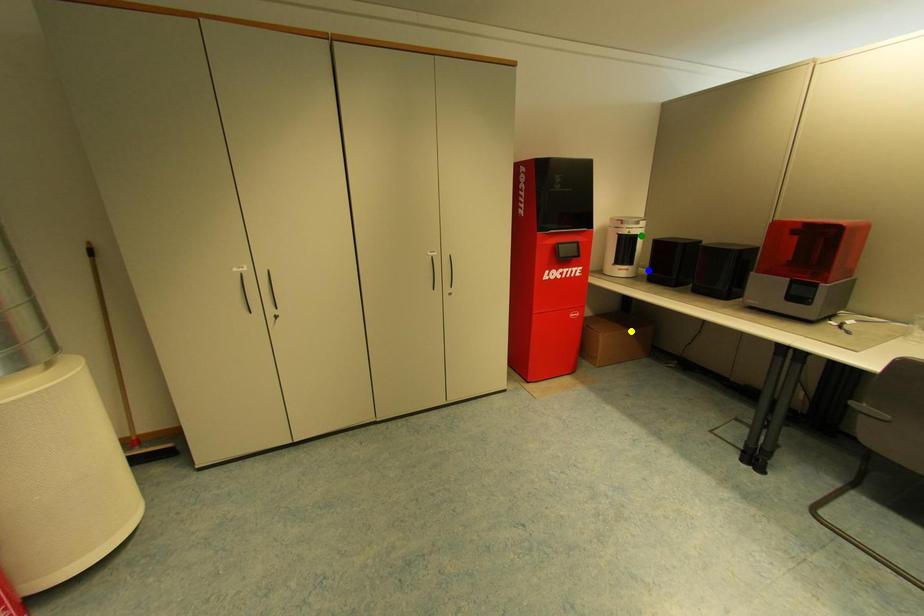
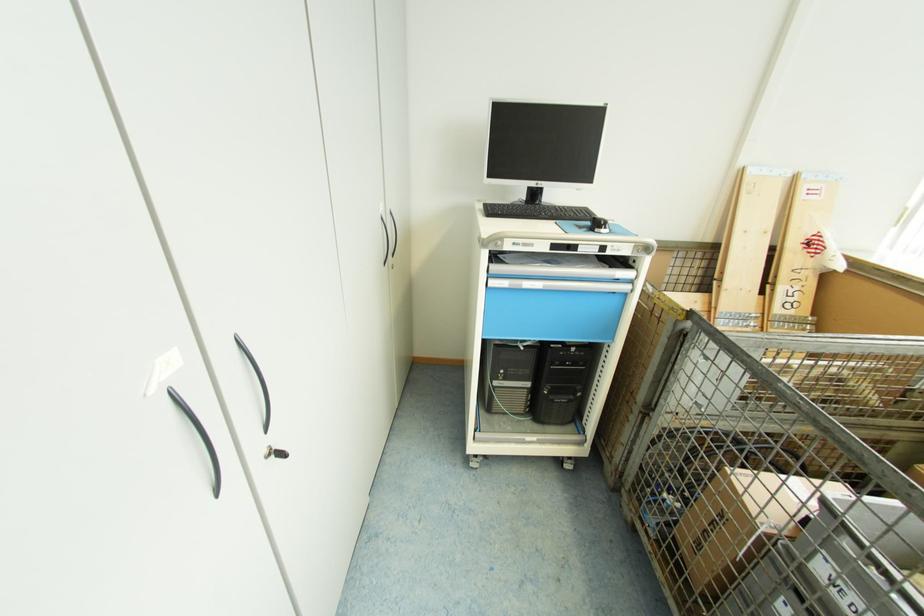
I am providing you with two images of the same scene from different viewpoints. Three points are marked in image1. Which point corresponds to a part or object that is occluded in image2?In image1, three points are marked. Which of them correspond to a part or object that is occluded in image2?Among the three points shown in image1, which one corresponds to a part or object that is no longer visible due to occlusion in image2?

Invisible in image2: yellow point, blue point, green point.